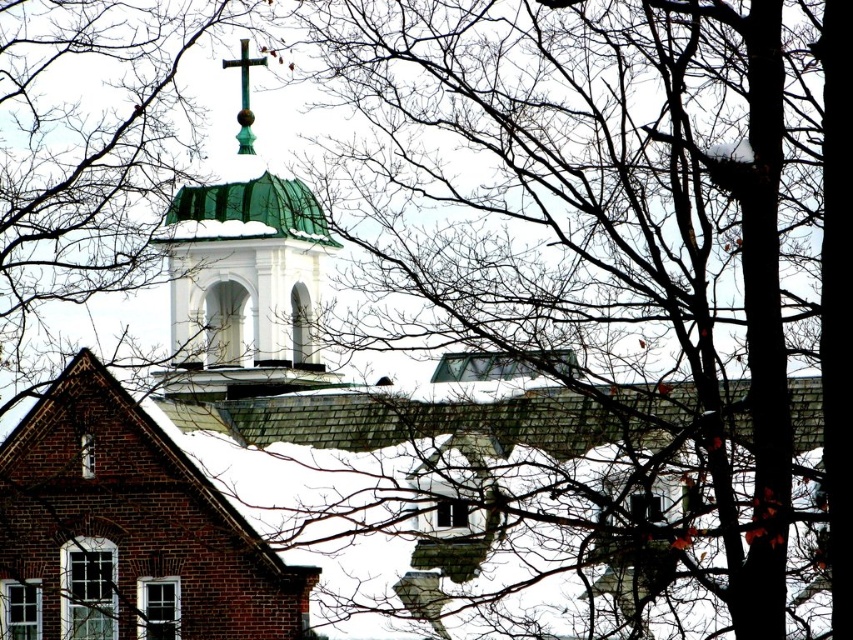
Question: Which of the following is the closest to the observer?

Choices:
 (A) (239, 61)
 (B) (51, 497)

Answer: (B)

Question: Considering the relative positions of brick church at center and green patinated metal cross at upper center in the image provided, where is brick church at center located with respect to green patinated metal cross at upper center?

Choices:
 (A) right
 (B) left

Answer: (B)

Question: Is brick church at center thinner than green patinated metal cross at upper center?

Choices:
 (A) yes
 (B) no

Answer: (B)

Question: Does brick church at center have a greater width compared to green patinated metal cross at upper center?

Choices:
 (A) yes
 (B) no

Answer: (A)

Question: Among these points, which one is nearest to the camera?

Choices:
 (A) (117, 461)
 (B) (247, 131)

Answer: (A)